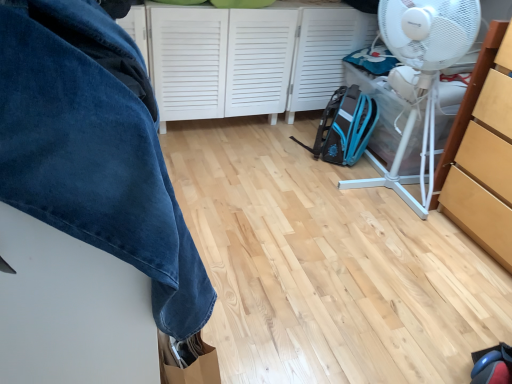
You are a GUI agent. You are given a task and a screenshot of the screen. Output one action in this format:
    pyautogui.click(x=<x>, y=<y>)
    Task: Click on the blank space to the left of teal fabric backpack at center-right
    Image resolution: width=512 pixels, height=384 pixels.
    Given the screenshot: What is the action you would take?
    pyautogui.click(x=278, y=145)